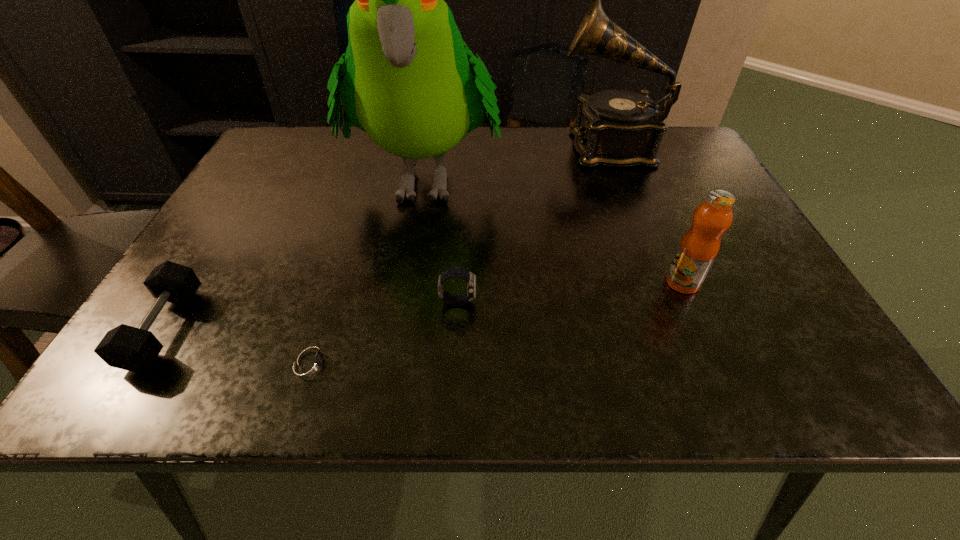
Find the location of a particular element. The image size is (960, 540). object that ranks as the closest to the dumbbell is located at coordinates (310, 362).

Locate which object ranks fourth in proximity to the fruit juice. Please provide its 2D coordinates. Your answer should be formatted as a tuple, i.e. [(x, y)], where the tuple contains the x and y coordinates of a point satisfying the conditions above.

[(310, 362)]

The image size is (960, 540). Identify the location of free space that satisfies the following two spatial constraints: 1. on the horn of the second tallest object; 2. on the right side of the fourth shortest object. (661, 282).

In order to click on vacant space that satisfies the following two spatial constraints: 1. on the horn of the fifth shortest object; 2. on the front side of the dumbbell in this screenshot , I will do `click(680, 328)`.

This screenshot has width=960, height=540. Identify the location of vacant area that satisfies the following two spatial constraints: 1. on the horn of the phonograph record; 2. on the beak of the tallest object. (620, 176).